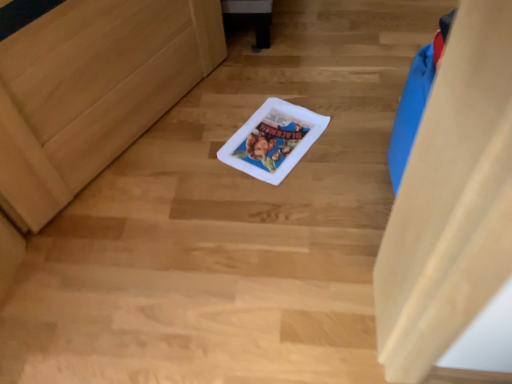
The height and width of the screenshot is (384, 512). In order to click on empty space that is ontop of white matte comic book at center (from a real-world perspective) in this screenshot , I will do `click(271, 137)`.